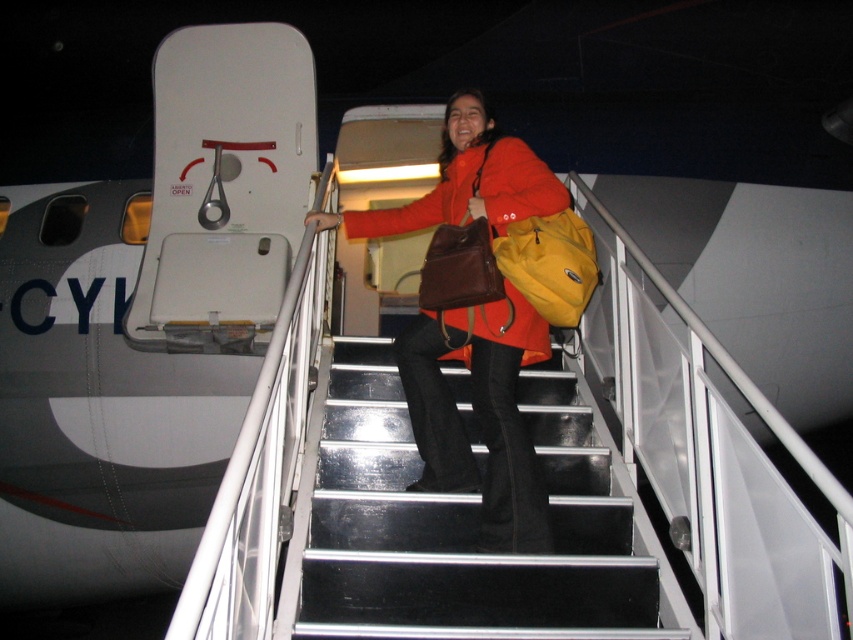
Question: Can you confirm if metallic silver stairs at center is wider than leather brown bag at center?

Choices:
 (A) no
 (B) yes

Answer: (B)

Question: Does matte orange coat at center appear on the right side of leather brown bag at center?

Choices:
 (A) no
 (B) yes

Answer: (B)

Question: Can you confirm if metallic silver stairs at center is bigger than yellow fabric backpack at center?

Choices:
 (A) yes
 (B) no

Answer: (A)

Question: Among these objects, which one is nearest to the camera?

Choices:
 (A) matte orange jacket at center
 (B) metallic silver stairs at center
 (C) matte orange coat at center
 (D) leather brown bag at center

Answer: (B)

Question: Which point is farther from the camera taking this photo?

Choices:
 (A) (460, 256)
 (B) (592, 481)
 (C) (468, 147)
 (D) (585, 237)

Answer: (C)

Question: Among these objects, which one is nearest to the camera?

Choices:
 (A) matte orange coat at center
 (B) matte orange jacket at center
 (C) leather brown bag at center
 (D) metallic silver stairs at center

Answer: (D)